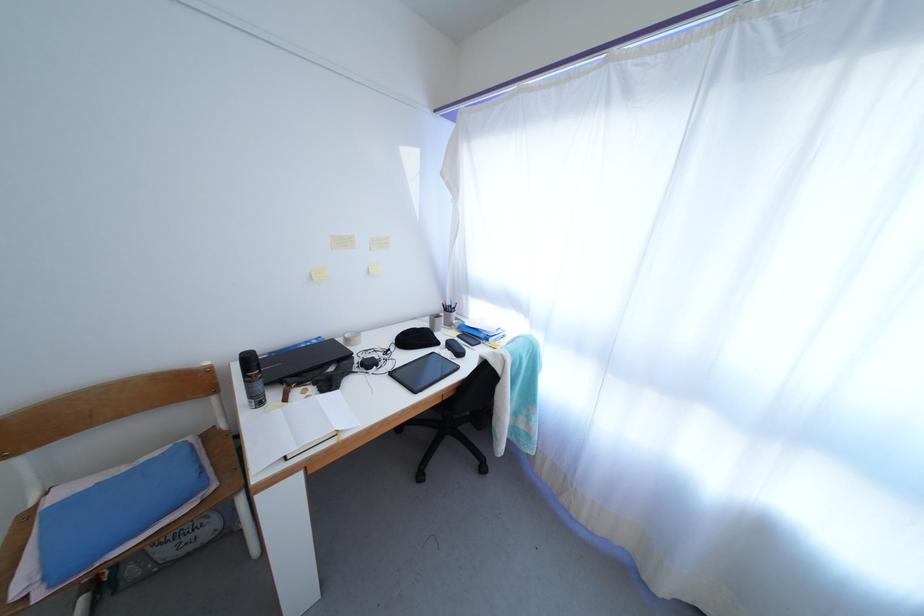
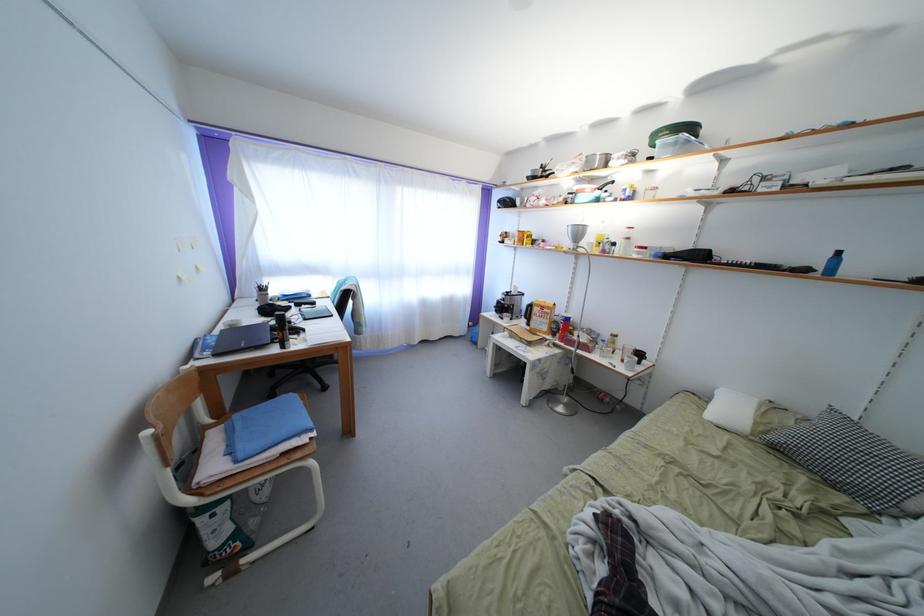
Question: I am providing you with two images of the same scene from different viewpoints. After the viewpoint changes to image2, which objects are now occluded?

Choices:
 (A) blue ceramic jug
 (B) black tablet
 (C) yellow cereal box
 (D) blue bottle

Answer: (B)